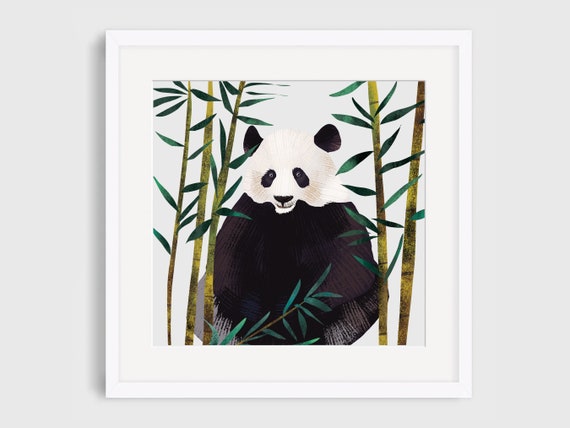
Find the location of a particular element. The width and height of the screenshot is (570, 428). white frame is located at coordinates (279, 39).